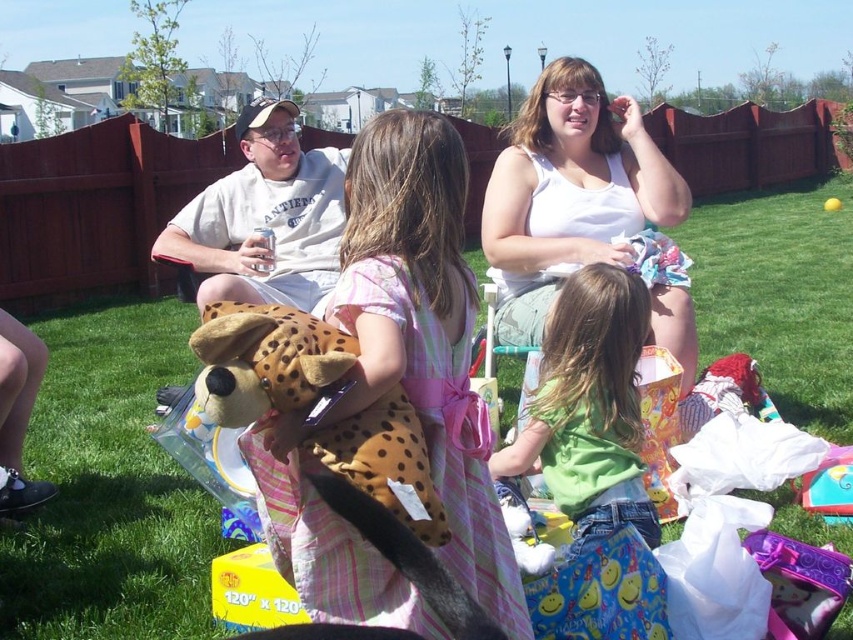
You are a photographer at the birthday party and want to capture a photo that includes both the white cotton tank top at upper center and the green cotton shirt at center. Based on their positions, which one should you focus on first to ensure both are in frame?

The white cotton tank top at upper center is located above the green cotton shirt at center, so you should focus on the white cotton tank top at upper center first to ensure both are in frame.